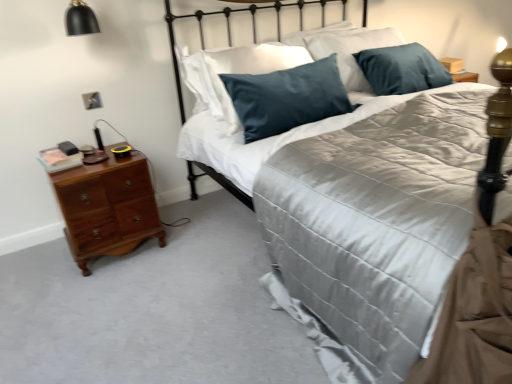
Question: From the image's perspective, is satin black headboard at upper center above or below cherry wood nightstand at left?

Choices:
 (A) below
 (B) above

Answer: (B)

Question: Is point (298, 14) closer or farther from the camera than point (136, 241)?

Choices:
 (A) farther
 (B) closer

Answer: (A)

Question: Which of these objects is positioned farthest from the matte silver outlet at lower left?

Choices:
 (A) cherry wood nightstand at left
 (B) black matte lampshade at upper left
 (C) satin black headboard at upper center
 (D) satin gray bed at center

Answer: (D)

Question: Which is farther from the cherry wood nightstand at left?

Choices:
 (A) black matte lampshade at upper left
 (B) matte silver outlet at lower left
 (C) satin black headboard at upper center
 (D) satin gray bed at center

Answer: (D)